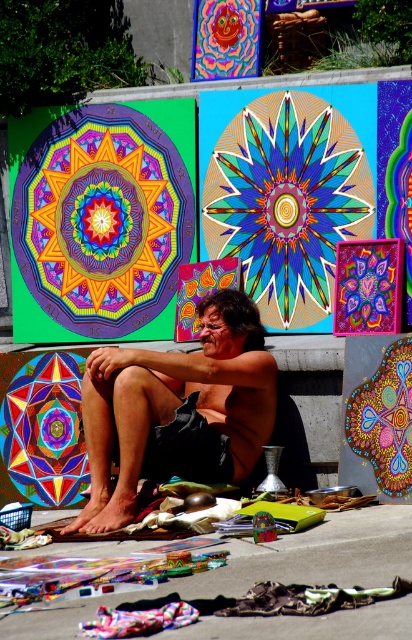
Which is above, textured fabric at lower center or multicolored mandala at center?

Positioned higher is multicolored mandala at center.

Consider the image. Who is more forward, (355, 630) or (42, 356)?

Point (355, 630) is in front.

This screenshot has height=640, width=412. In order to click on textured fabric at lower center in this screenshot , I will do `click(264, 566)`.

Does vibrant fabric mandala at center have a lesser width compared to textured fabric at lower center?

In fact, vibrant fabric mandala at center might be wider than textured fabric at lower center.

Can you confirm if vibrant fabric mandala at center is bigger than textured fabric at lower center?

Yes.

Who is more forward, (x=77, y=298) or (x=309, y=627)?

Point (x=309, y=627) is in front.

This screenshot has height=640, width=412. Identify the location of vibrant fabric mandala at center. (100, 216).

Consider the image. Does shiny black shorts at center have a lesser width compared to textured fabric at lower center?

No, shiny black shorts at center is not thinner than textured fabric at lower center.

Who is shorter, shiny black shorts at center or textured fabric at lower center?

textured fabric at lower center

This screenshot has height=640, width=412. What do you see at coordinates (177, 410) in the screenshot?
I see `shiny black shorts at center` at bounding box center [177, 410].

Find the location of a particular element. The width and height of the screenshot is (412, 640). shiny black shorts at center is located at coordinates (177, 410).